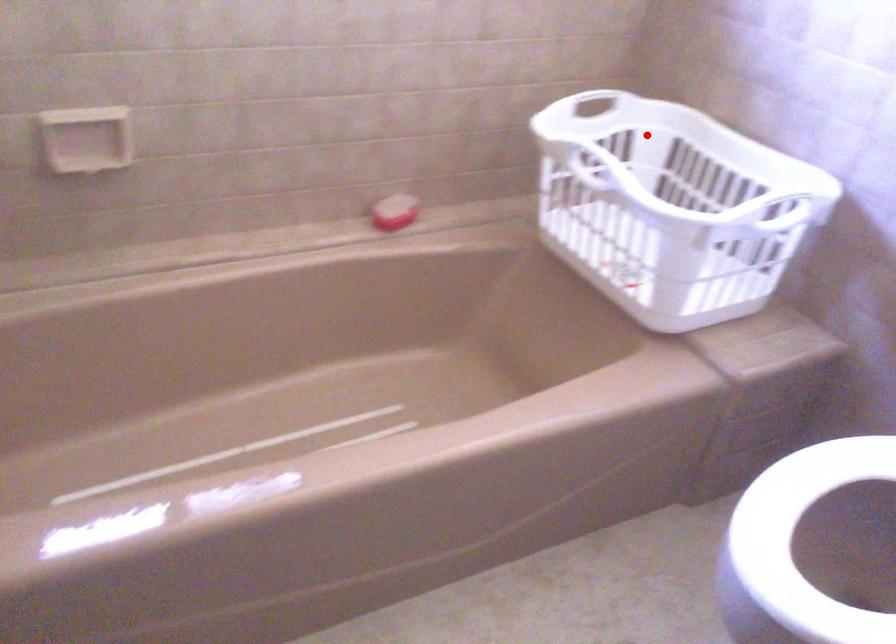
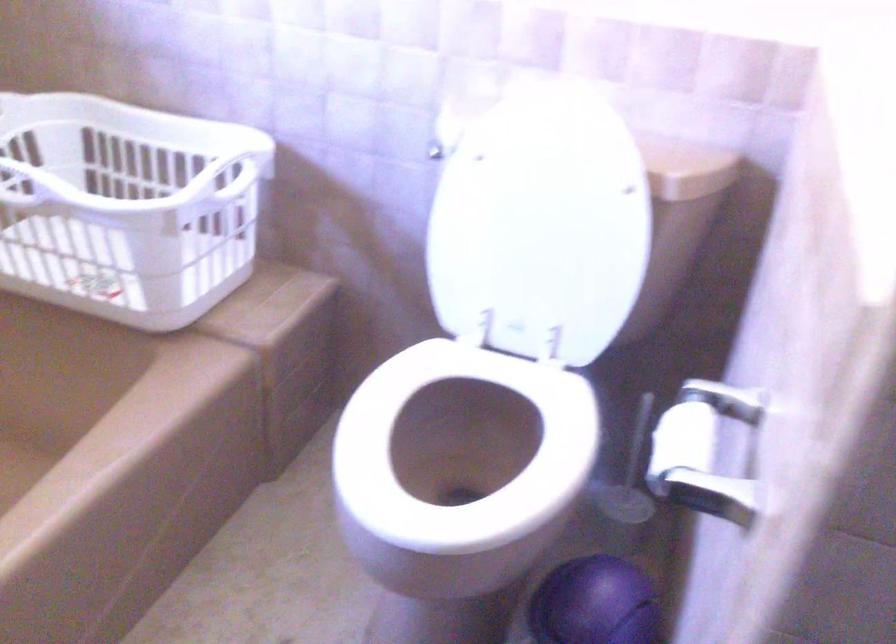
Where in the second image is the point corresponding to the highlighted location from the first image?

(55, 138)